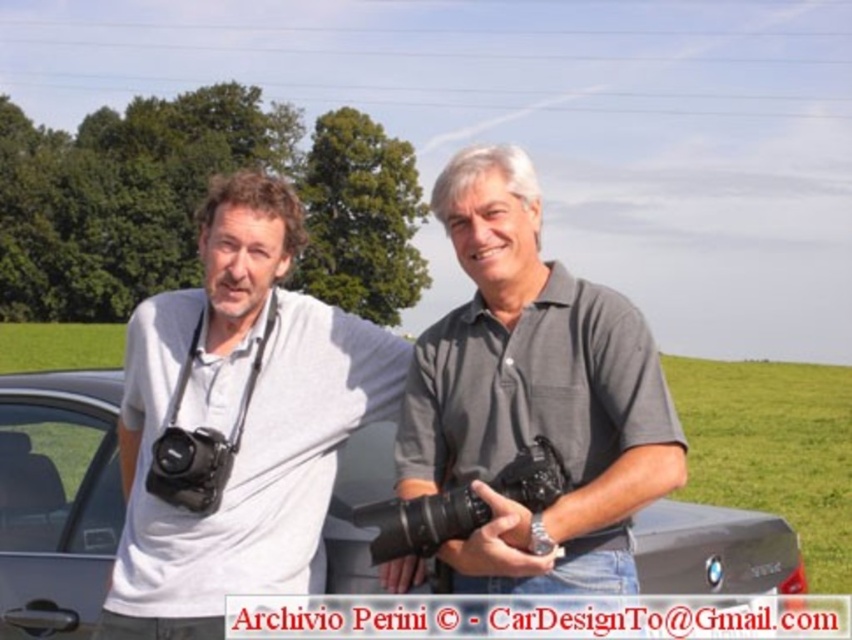
Is gray cotton polo shirt at center to the right of black plastic camera at center from the viewer's perspective?

Correct, you'll find gray cotton polo shirt at center to the right of black plastic camera at center.

Can you confirm if gray cotton polo shirt at center is shorter than black plastic camera at center?

In fact, gray cotton polo shirt at center may be taller than black plastic camera at center.

The image size is (852, 640). What do you see at coordinates (533, 396) in the screenshot?
I see `gray cotton polo shirt at center` at bounding box center [533, 396].

This screenshot has width=852, height=640. Find the location of `gray cotton polo shirt at center`. gray cotton polo shirt at center is located at coordinates (533, 396).

Can you confirm if matte gray shirt at left is positioned below black matte camera at left?

Incorrect, matte gray shirt at left is not positioned below black matte camera at left.

From the picture: Which is more to the right, matte gray shirt at left or black matte camera at left?

From the viewer's perspective, matte gray shirt at left appears more on the right side.

Is point (203, 564) in front of point (217, 445)?

Yes, point (203, 564) is in front of point (217, 445).

Identify the location of matte gray shirt at left. The image size is (852, 640). (237, 420).

What do you see at coordinates (237, 420) in the screenshot? This screenshot has height=640, width=852. I see `matte gray shirt at left` at bounding box center [237, 420].

Where is `matte gray shirt at left`? Image resolution: width=852 pixels, height=640 pixels. matte gray shirt at left is located at coordinates (237, 420).

You are a GUI agent. You are given a task and a screenshot of the screen. Output one action in this format:
    pyautogui.click(x=<x>, y=<y>)
    Task: Click on the matte gray shirt at left
    The width and height of the screenshot is (852, 640).
    Given the screenshot: What is the action you would take?
    pyautogui.click(x=237, y=420)